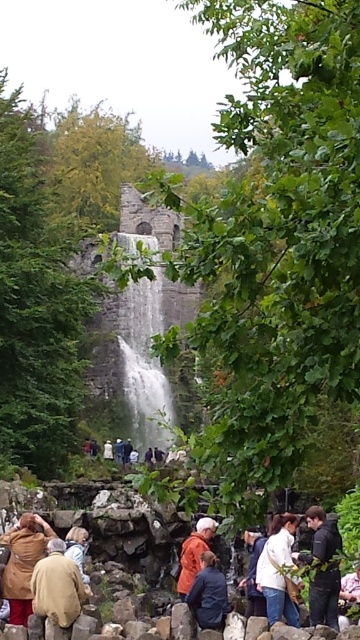
You are a photographer planning to take a group photo of the tourists at the waterfall. You need to ensure that both the white textured water at center and the brown woolen coat at lower left are visible in the frame. Based on their positions, which object should be placed closer to the camera to ensure both are in focus?

The brown woolen coat at lower left should be placed closer to the camera because it is positioned closer to the photographer than the white textured water at center, which is further away. This ensures both objects remain in focus.

You are a photographer planning to take a photo of the white textured water at center and the brown woolen coat at lower left. To ensure both are in frame, should you adjust your camera to focus more to the right or left side of the scene?

The white textured water at center is positioned on the right side of brown woolen coat at lower left, so to include both in the frame, you should adjust your camera to focus more to the right side of the scene.